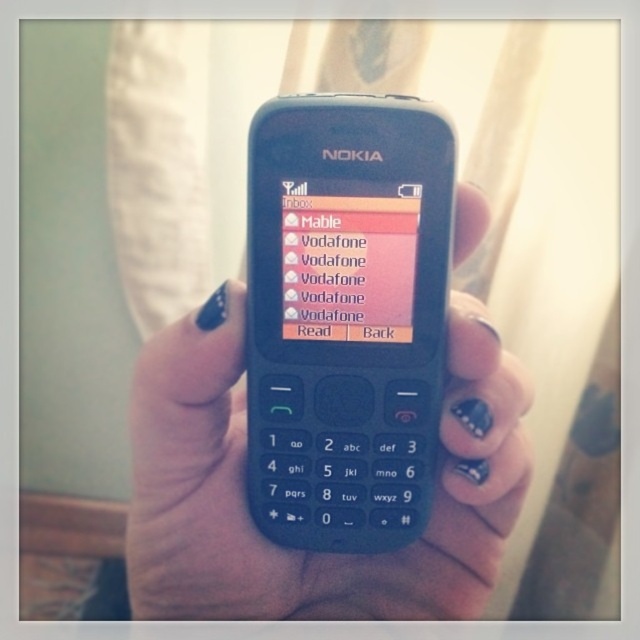
Question: Is matte plastic nokia phone at center positioned behind pink glossy text message at center?

Choices:
 (A) no
 (B) yes

Answer: (A)

Question: Which of the following is the farthest from the observer?

Choices:
 (A) pink glossy text message at center
 (B) nail-polished skin at center
 (C) matte plastic nokia phone at center

Answer: (B)

Question: Is matte plastic nokia phone at center to the left of nail-polished skin at center from the viewer's perspective?

Choices:
 (A) no
 (B) yes

Answer: (A)

Question: From the image, what is the correct spatial relationship of nail-polished skin at center in relation to pink glossy text message at center?

Choices:
 (A) right
 (B) left

Answer: (B)

Question: Which point appears farthest from the camera in this image?

Choices:
 (A) (294, 380)
 (B) (385, 310)

Answer: (A)

Question: Among these objects, which one is nearest to the camera?

Choices:
 (A) pink glossy text message at center
 (B) matte plastic nokia phone at center

Answer: (B)